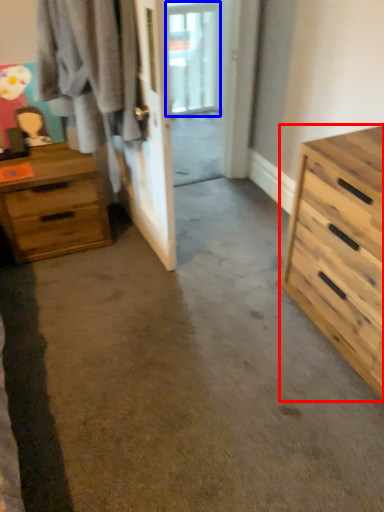
Question: Which object appears farthest to the camera in this image, chest of drawers (highlighted by a red box) or window (highlighted by a blue box)?

Choices:
 (A) chest of drawers
 (B) window

Answer: (B)